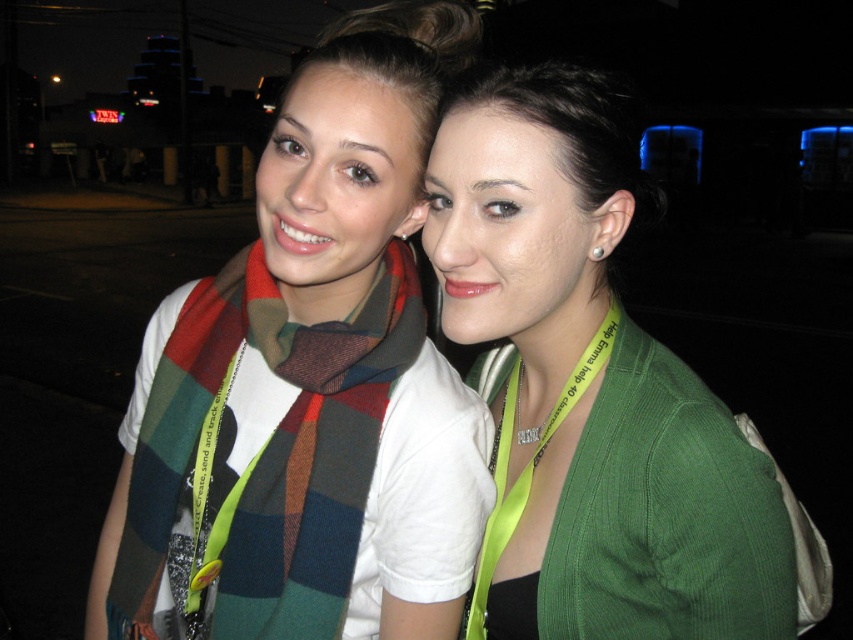
Who is positioned more to the left, green corduroy cardigan at center or plaid wool scarf at left?

Positioned to the left is plaid wool scarf at left.

Between point (447, 189) and point (152, 474), which one is positioned in front?

Point (447, 189)

Is point (430, 216) positioned after point (341, 406)?

That is False.

Locate an element on the screen. The width and height of the screenshot is (853, 640). green corduroy cardigan at center is located at coordinates (589, 390).